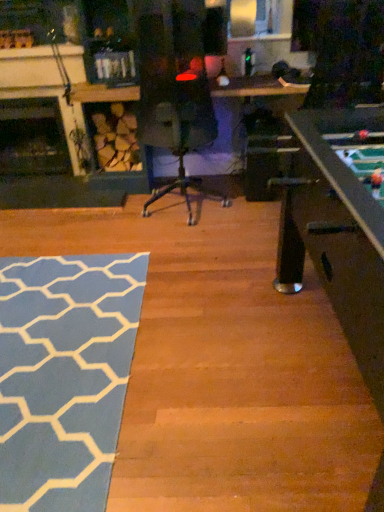
Image resolution: width=384 pixels, height=512 pixels. In order to click on free spot below blue textured rug at lower left (from a real-world perspective) in this screenshot , I will do `click(51, 355)`.